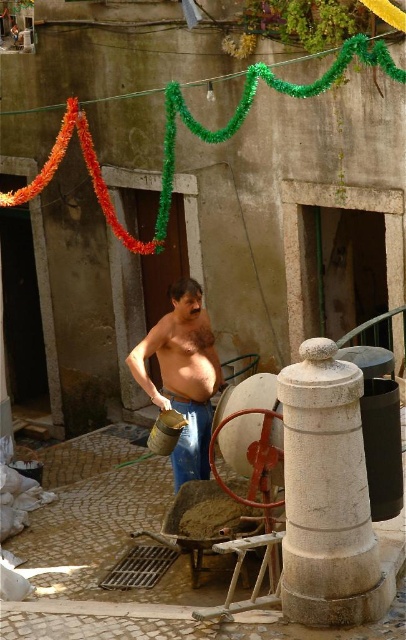
You are a construction worker carrying a heavy tool box. You need to walk through the narrow alleyway between the white stone pillar at center and the blue denim jeans at center. Can you pass through without touching either object?

The white stone pillar at center might be wider than blue denim jeans at center, so there may not be enough space to pass through without touching them. It is recommended to check the width before attempting to go through.

You are standing in the courtyard and want to place a small potted plant exactly at point (328, 497). However, there is an object already located there. What object is blocking that spot?

The white stone pillar at center is located at point (328, 497), so it is blocking the spot where you want to place the small potted plant.

You are a construction worker in the courtyard. You need to move the shiny metallic bucket at center to the wheelbarrow. Can you directly reach it without moving around the white stone pillar at center?

The white stone pillar at center is in front of the shiny metallic bucket at center, so you cannot directly reach the shiny metallic bucket at center without moving around the white stone pillar at center.